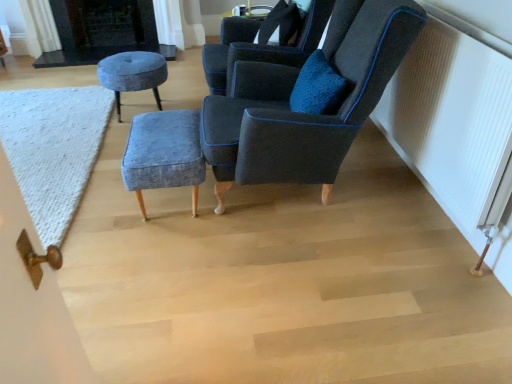
The height and width of the screenshot is (384, 512). In order to click on vacant area that lies to the right of denim fabric stool at center, placed as the first stool when sorted from bottom to top in this screenshot , I will do 254,212.